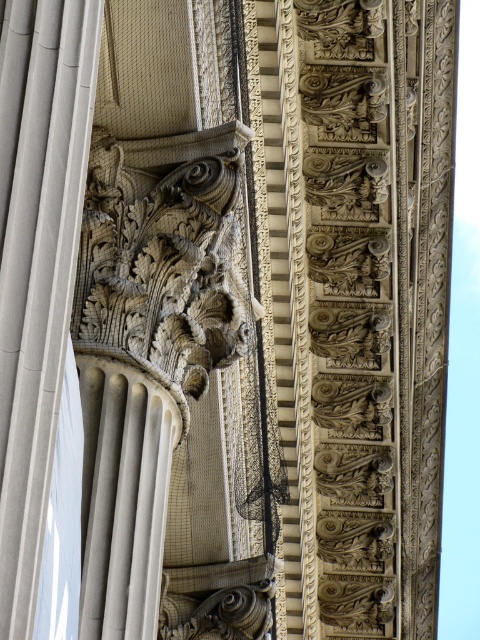
Question: Among these points, which one is farthest from the camera?

Choices:
 (A) (50, 436)
 (B) (112, 360)

Answer: (B)

Question: Considering the relative positions of carved stone column at center and smooth stone column at center in the image provided, where is carved stone column at center located with respect to smooth stone column at center?

Choices:
 (A) right
 (B) left

Answer: (B)

Question: Does carved stone column at center appear under smooth stone column at center?

Choices:
 (A) yes
 (B) no

Answer: (B)

Question: Is carved stone column at center positioned at the back of smooth stone column at center?

Choices:
 (A) yes
 (B) no

Answer: (B)